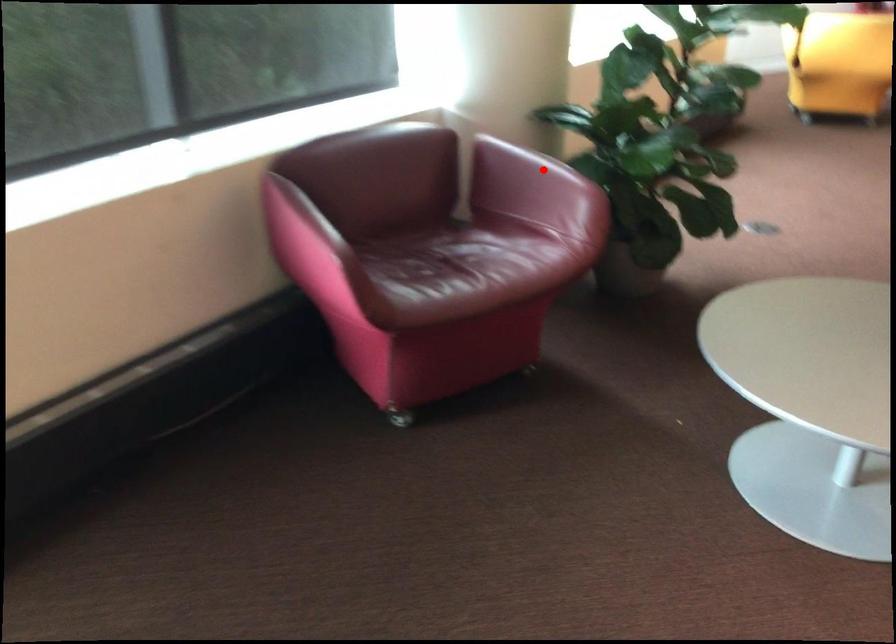
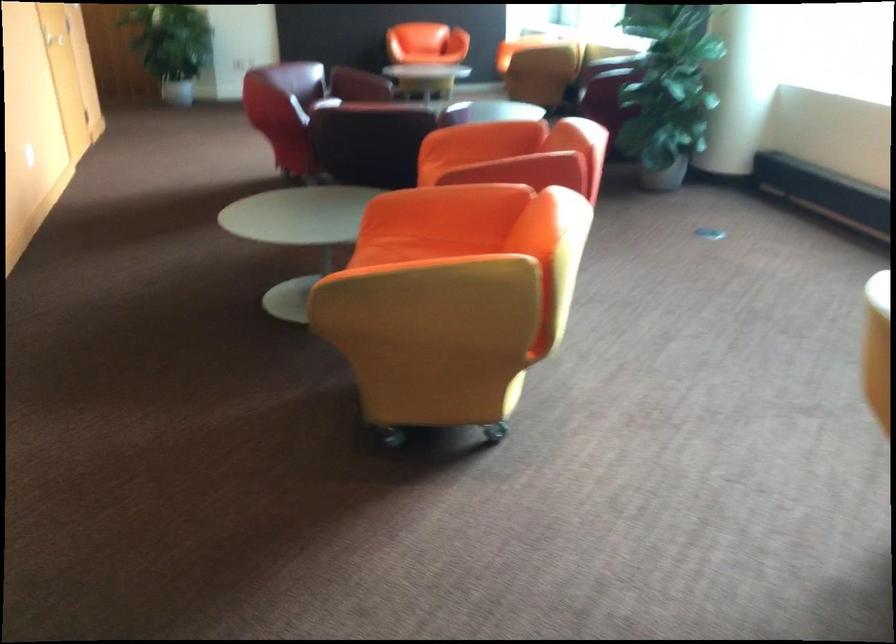
Question: I am providing you with two images of the same scene from different viewpoints. A red point is marked on the first image. Is the red point's position out of view in image 2?

Choices:
 (A) Yes
 (B) No

Answer: (A)